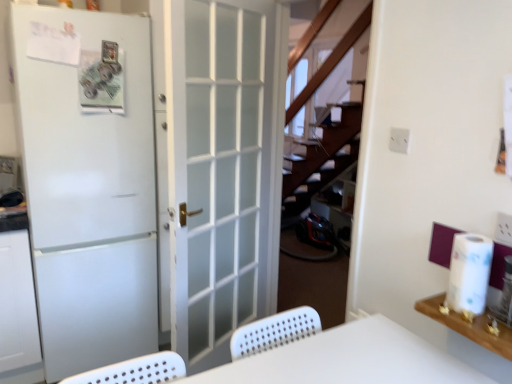
The width and height of the screenshot is (512, 384). I want to click on empty space that is ontop of white wood shelf at upper right (from a real-world perspective), so click(482, 320).